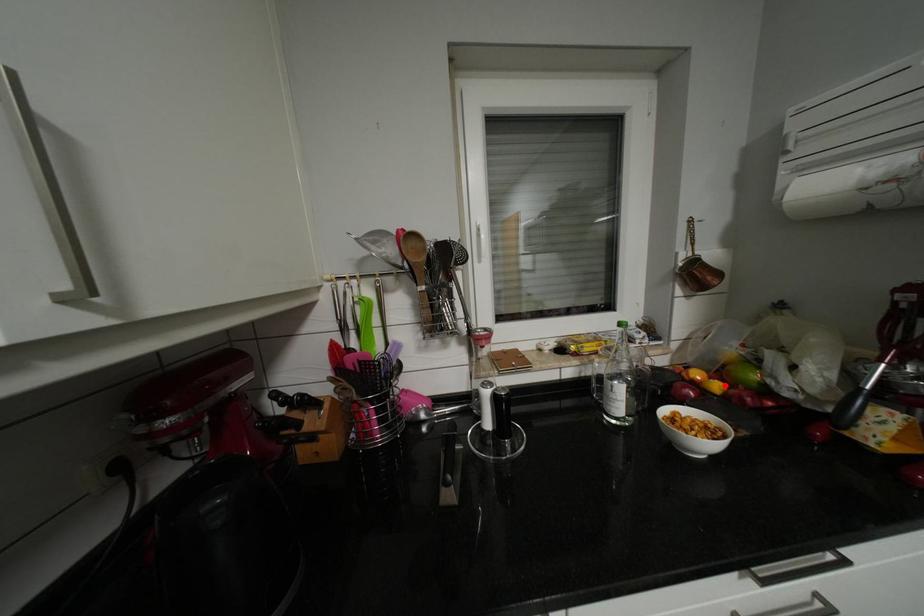
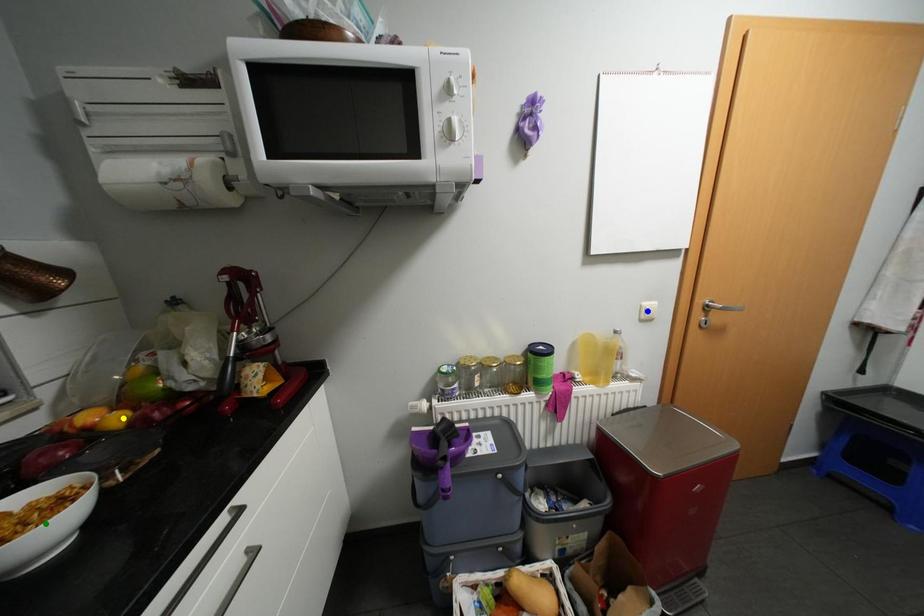
Question: I am providing you with two images of the same scene from different viewpoints. A red point is marked on the first image. You are given multiple points on the second image. In image 2, which mark is for the same physical point as the one in image 1?

Choices:
 (A) green point
 (B) yellow point
 (C) blue point

Answer: (B)